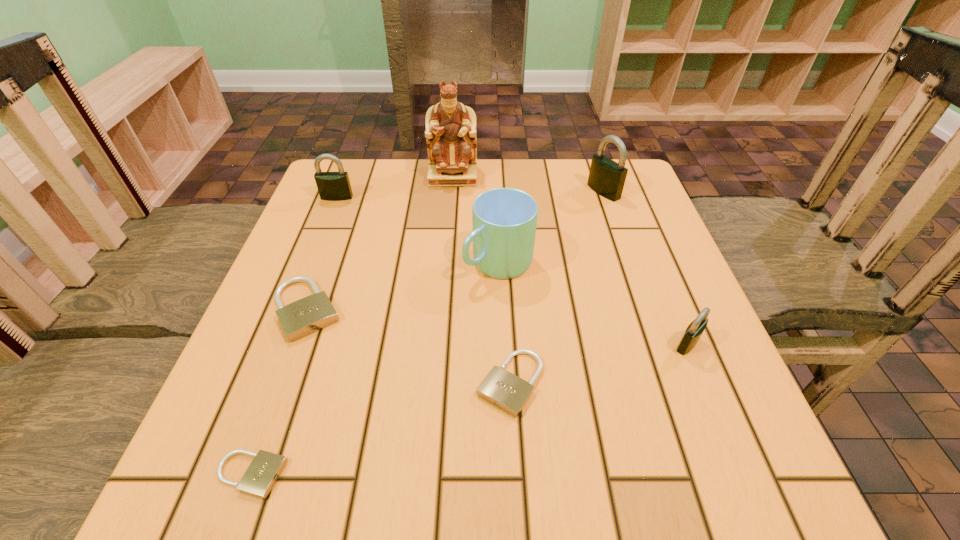
Identify the location of vacant region located 0.320m on the back of the shortest object. The width and height of the screenshot is (960, 540). (316, 292).

Locate an element on the screen. The image size is (960, 540). figurine located at the far edge is located at coordinates (450, 132).

This screenshot has height=540, width=960. Identify the location of object that is at the near edge. (260, 477).

This screenshot has height=540, width=960. I want to click on object that is positioned at the far left corner, so click(x=332, y=186).

I want to click on object at the near left corner, so click(x=260, y=477).

Locate an element on the screen. Image resolution: width=960 pixels, height=540 pixels. object positioned at the far right corner is located at coordinates (606, 177).

In the image, there is a desktop. Where is `vacant space at the near edge`? vacant space at the near edge is located at coordinates (372, 456).

In order to click on vacant space at the left edge of the desktop in this screenshot , I will do click(327, 246).

In the image, there is a desktop. What are the coordinates of `vacant space at the right edge` in the screenshot? It's located at (694, 429).

In order to click on vacant space at the far left corner of the desktop in this screenshot , I will do `click(349, 207)`.